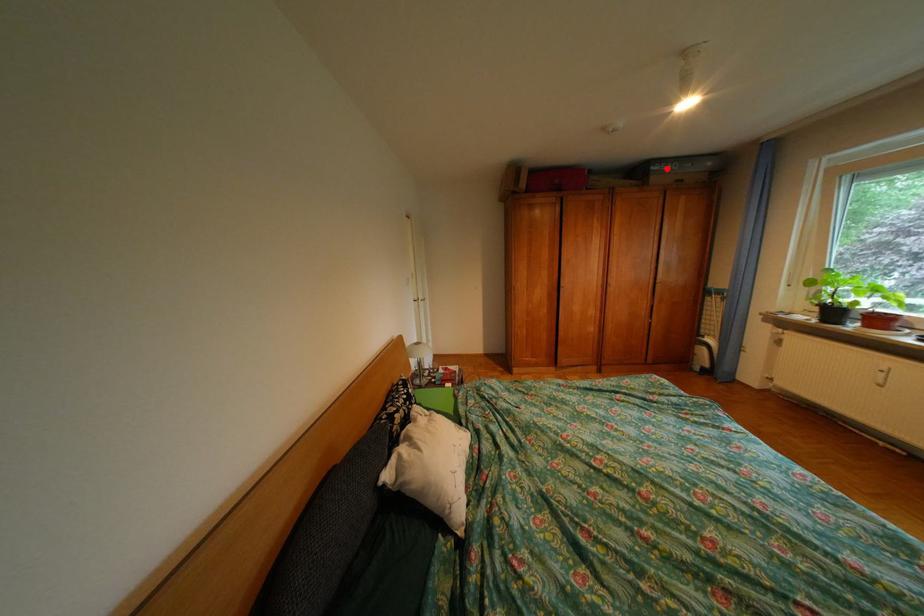
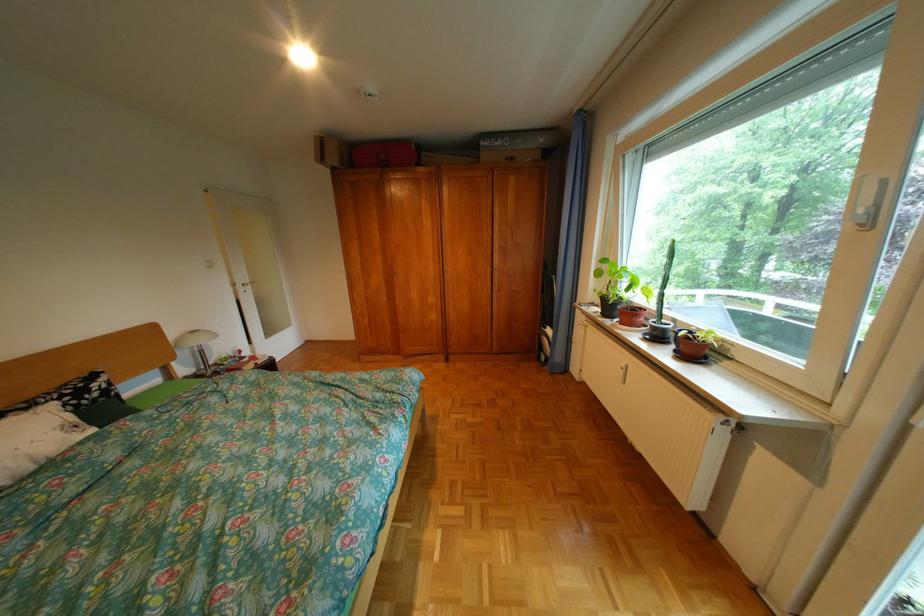
Question: I am providing you with two images of the same scene from different viewpoints. A red point is shown in image1. For the corresponding object point in image2, is it positioned nearer or farther from the camera?

Choices:
 (A) Nearer
 (B) Farther

Answer: (A)